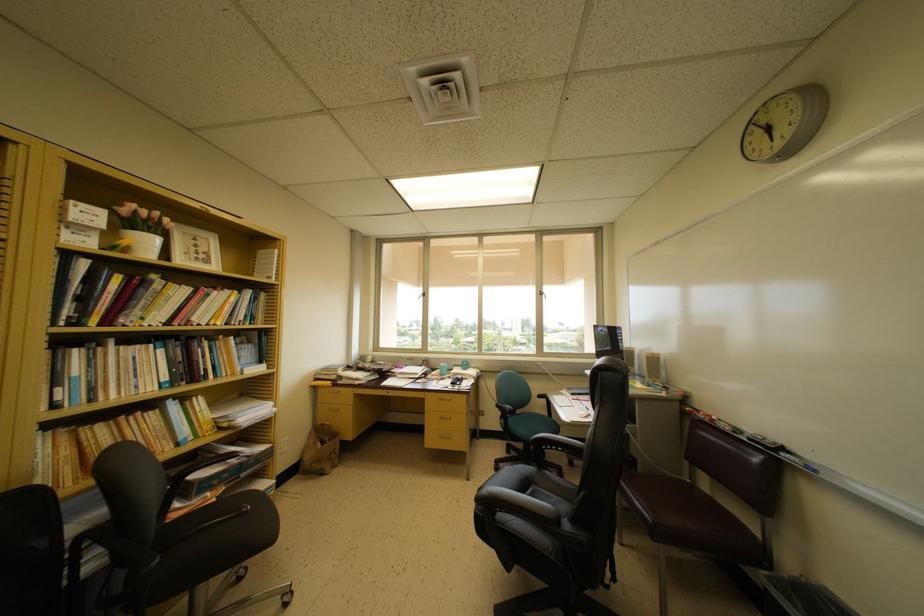
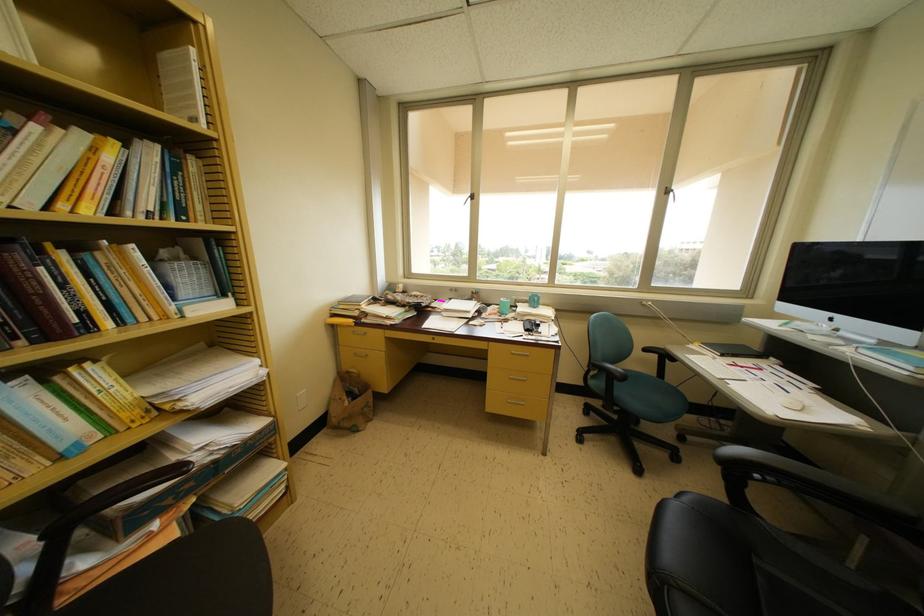
The point at (469, 370) is marked in the first image. Where is the corresponding point in the second image?

(538, 306)